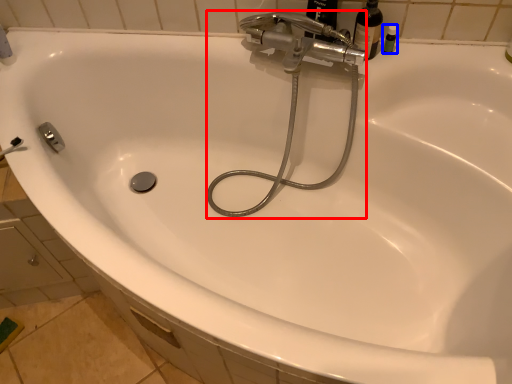
Question: Which point is closer to the camera, plumbing fixture (highlighted by a red box) or toiletry (highlighted by a blue box)?

Choices:
 (A) plumbing fixture
 (B) toiletry

Answer: (A)